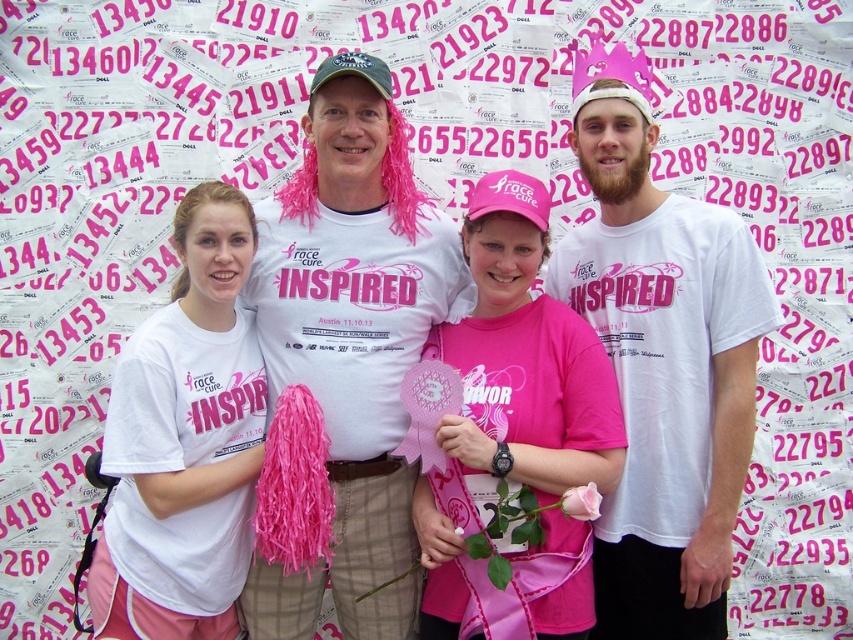
What is located at the coordinates point (351, 340)?

The matte white shirt at center is located at point (351, 340).